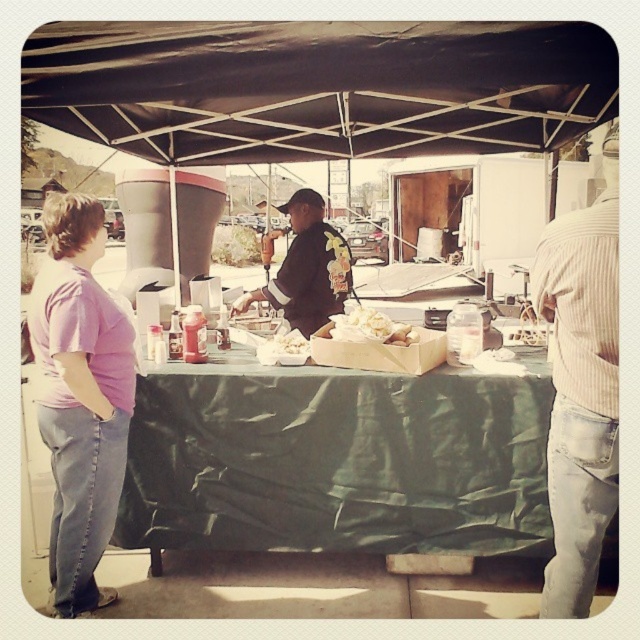
Question: In this image, where is black fabric canopy at center located relative to green fabric table at center?

Choices:
 (A) left
 (B) right

Answer: (B)

Question: Which object appears farthest from the camera in this image?

Choices:
 (A) green fabric table at center
 (B) black jersey at center
 (C) purple cotton shirt at left

Answer: (B)

Question: Which is nearer to the black jersey at center?

Choices:
 (A) white striped sweater at right
 (B) purple cotton shirt at left

Answer: (B)

Question: Considering the real-world distances, which object is farthest from the black jersey at center?

Choices:
 (A) white paper bag at center
 (B) white striped sweater at right

Answer: (B)

Question: Considering the relative positions of black fabric canopy at center and white striped sweater at right in the image provided, where is black fabric canopy at center located with respect to white striped sweater at right?

Choices:
 (A) right
 (B) left

Answer: (B)

Question: Observing the image, what is the correct spatial positioning of purple cotton shirt at left in reference to white striped sweater at right?

Choices:
 (A) above
 (B) below

Answer: (B)